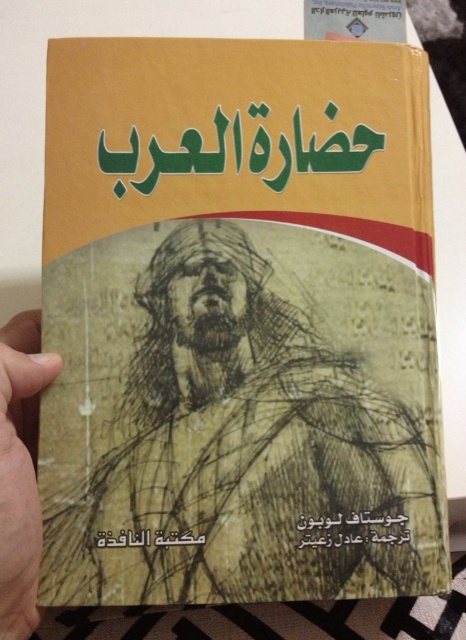
Which is above, skinny flesh at lower left or black paper at center?

skinny flesh at lower left is higher up.

Based on the photo, who is more distant from viewer, (15, 611) or (364, 516)?

Point (364, 516)

You are a GUI agent. You are given a task and a screenshot of the screen. Output one action in this format:
    pyautogui.click(x=<x>, y=<y>)
    Task: Click on the skinny flesh at lower left
    The width and height of the screenshot is (466, 640).
    Given the screenshot: What is the action you would take?
    pyautogui.click(x=20, y=470)